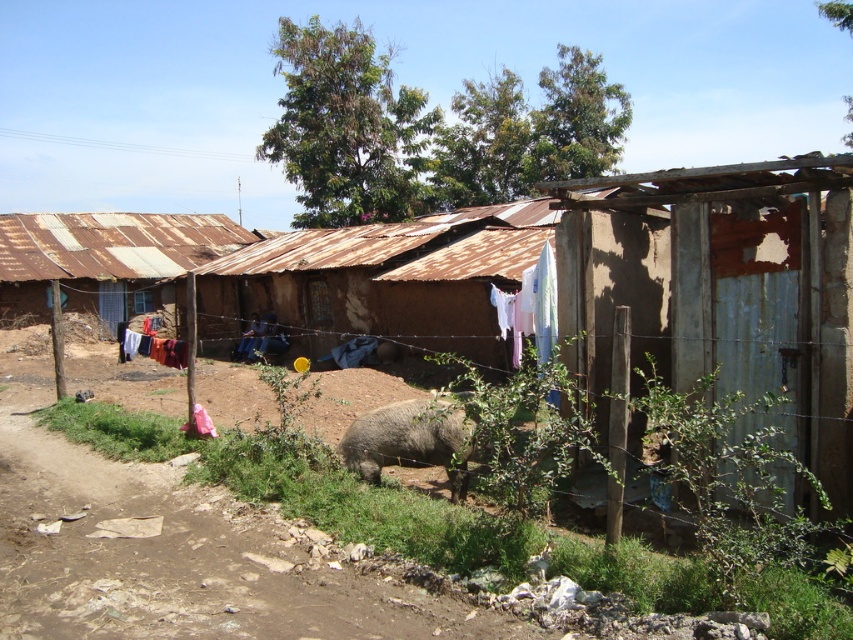
You are a delivery person carrying a package that is 3 meters long. You need to navigate through the path between the wire mesh at center and the white fabric at center. Can your package fit through the space between them?

The wire mesh at center is 3.04 meters away from the white fabric at center. Since the package is 3 meters long, it can fit through the space between them as the distance is slightly larger than the package.

You are standing on the dirt path in the village scene. You see a wire mesh at center and a white fabric at center. Which object is nearer to you?

The wire mesh at center is closer to the viewer than the white fabric at center.